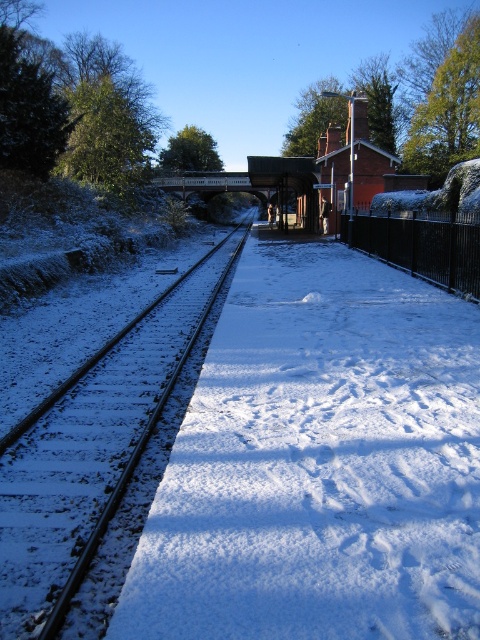
Question: Which object appears closest to the camera in this image?

Choices:
 (A) black metal fence at right
 (B) snow-covered metal track at center

Answer: (B)

Question: Which point appears farthest from the camera in this image?

Choices:
 (A) (395, 241)
 (B) (140, 323)

Answer: (A)

Question: Does snow-covered metal track at center have a lesser width compared to black metal fence at right?

Choices:
 (A) no
 (B) yes

Answer: (A)

Question: Does snow-covered metal track at center have a lesser width compared to black metal fence at right?

Choices:
 (A) no
 (B) yes

Answer: (A)

Question: Can you confirm if snow-covered metal track at center is wider than black metal fence at right?

Choices:
 (A) yes
 (B) no

Answer: (A)